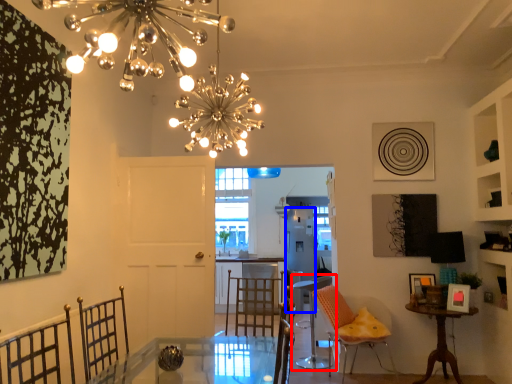
Question: Which of the following is the closest to the observer, chair (highlighted by a red box) or appliance (highlighted by a blue box)?

Choices:
 (A) chair
 (B) appliance

Answer: (A)